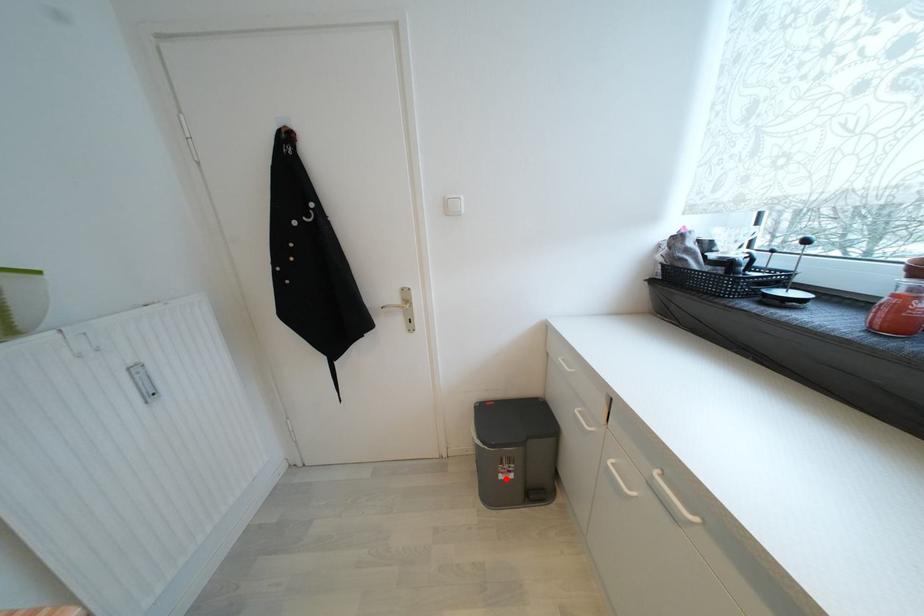
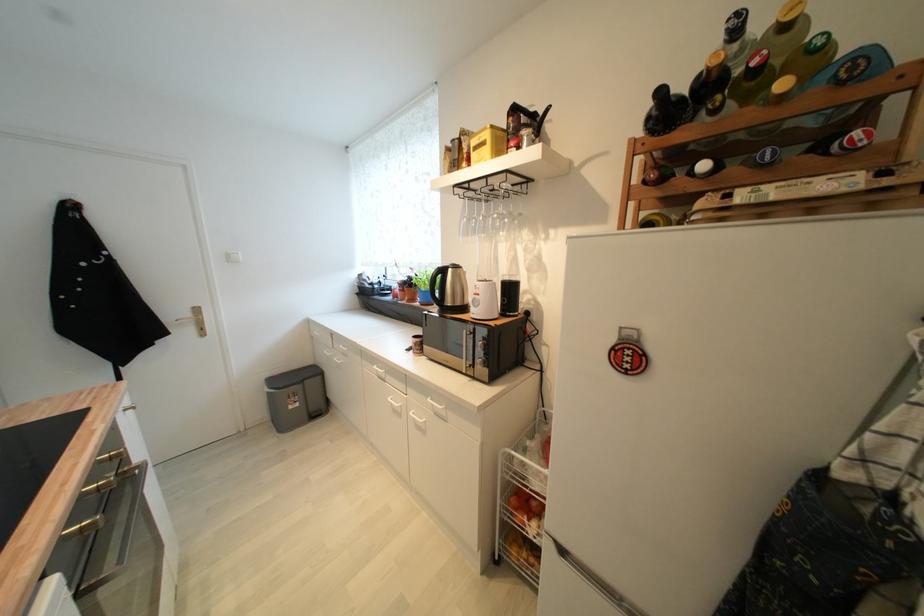
Question: A red point is marked in image1. In image2, is the corresponding 3D point closer to the camera or farther? Reply with the corresponding letter.

Choices:
 (A) The corresponding 3D point is closer.
 (B) The corresponding 3D point is farther.

Answer: (A)